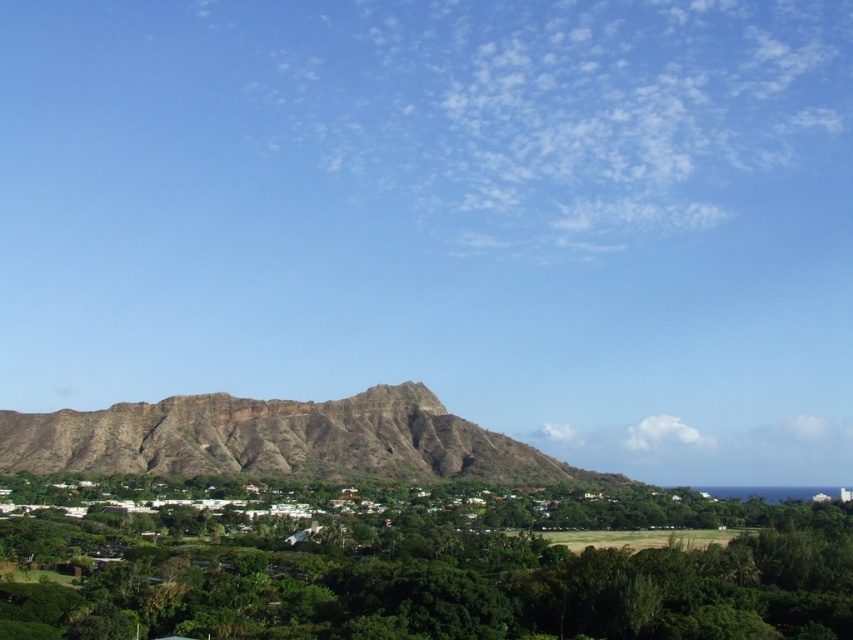
You are standing at the base of the mountain in the background and want to reach the green leafy tree at lower center. The path between them is 149.36 meters long. If you walk at a speed of 1.5 meters per second, how many minutes will it take you to reach the tree?

The distance between the mountain in the background and the green leafy tree at lower center is 149.36 meters. Walking at 1.5 meters per second, it would take approximately 99.57 seconds, which is about 1.66 minutes. So, it will take roughly 1.66 minutes to reach the tree.

You are standing at the base of the mountain and want to take a photo of the green leafy tree at lower center and the brown rocky hillside at center. Which object will appear closer to the camera in the photo?

The green leafy tree at lower center will appear closer to the camera because it is positioned in front of the brown rocky hillside at center.

You are a hiker planning to take a photo of the brown rocky hillside at center from the green leafy tree at lower center. Considering their heights, will the tree block your view of the hillside?

The green leafy tree at lower center is shorter than the brown rocky hillside at center, so the tree will not block the view of the hillside. You can take the photo without obstruction.